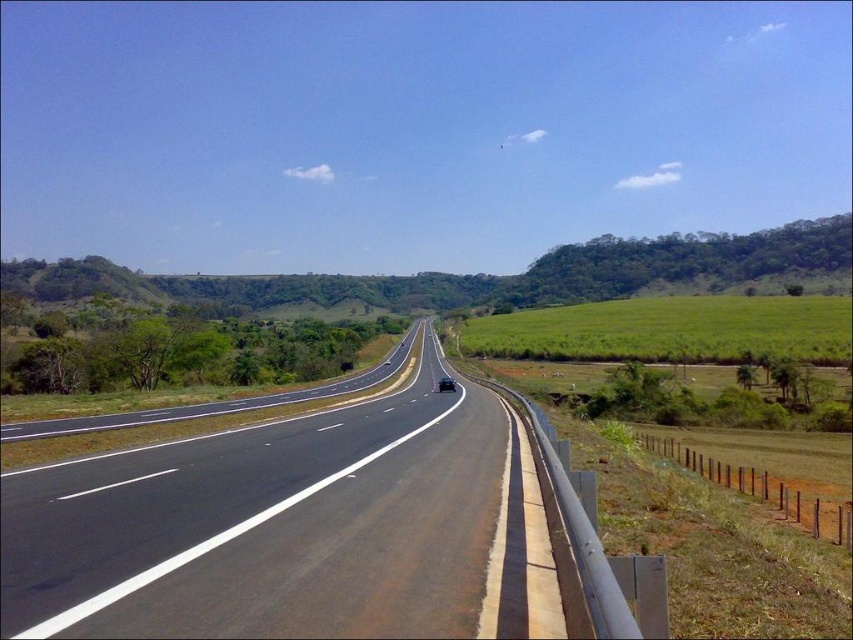
Is black asphalt highway at center thinner than shiny black sedan at center?

No.

Does black asphalt highway at center have a smaller size compared to shiny black sedan at center?

No, black asphalt highway at center is not smaller than shiny black sedan at center.

You are a GUI agent. You are given a task and a screenshot of the screen. Output one action in this format:
    pyautogui.click(x=<x>, y=<y>)
    Task: Click on the black asphalt highway at center
    The width and height of the screenshot is (853, 640).
    Given the screenshot: What is the action you would take?
    pyautogui.click(x=273, y=525)